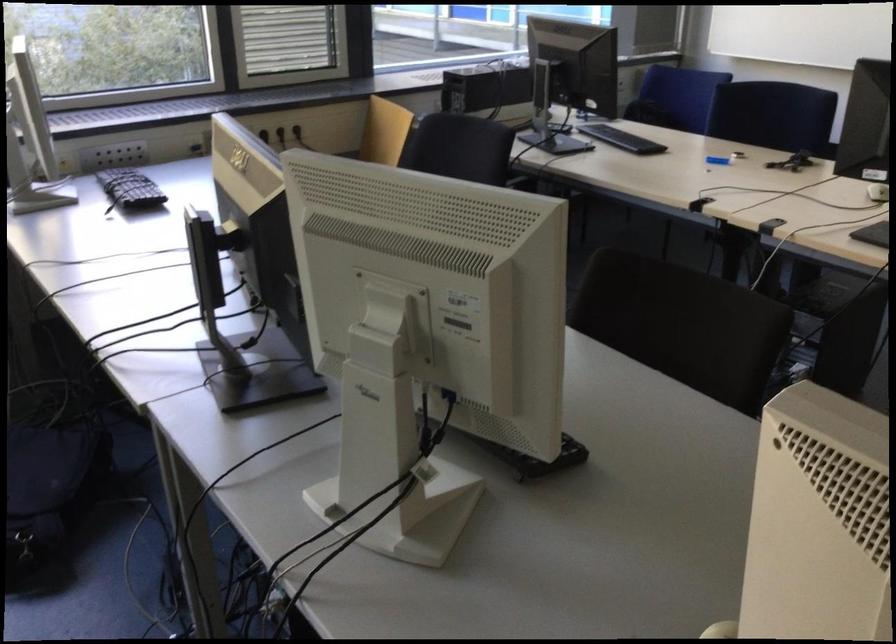
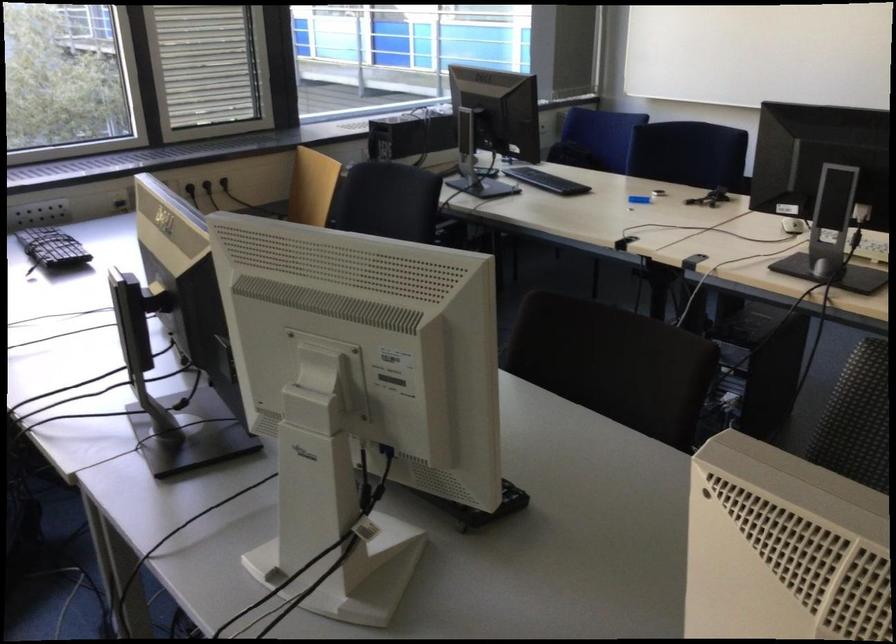
Find the pixel in the second image that matches point (382, 138) in the first image.

(312, 187)